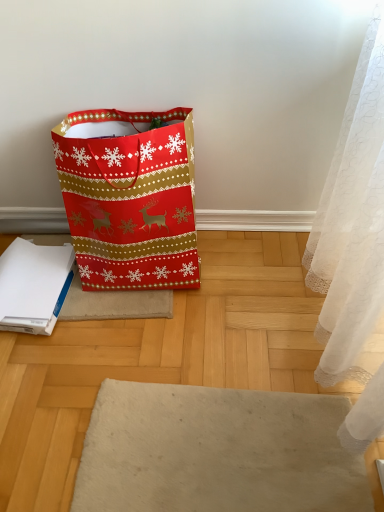
The width and height of the screenshot is (384, 512). Find the location of `free space to the right of shiny paper bag at left`. free space to the right of shiny paper bag at left is located at coordinates (252, 279).